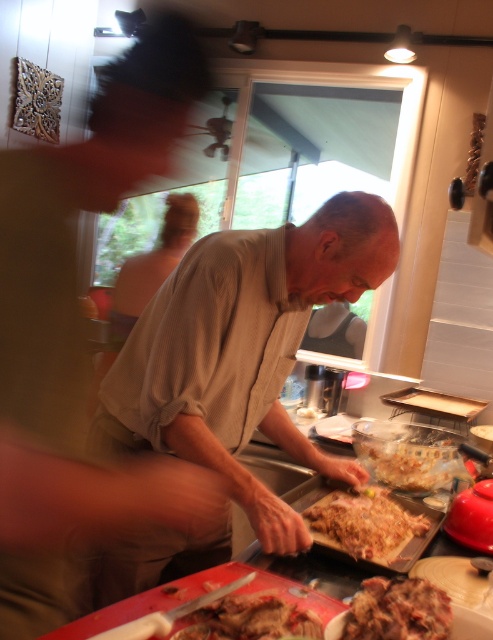
Question: Which point is closer to the camera?

Choices:
 (A) click(411, 484)
 (B) click(97, 602)
 (C) click(441, 616)

Answer: (C)

Question: Can you confirm if brown meat at center is thinner than brown crumbly bread at center?

Choices:
 (A) no
 (B) yes

Answer: (B)

Question: Can you confirm if light beige shirt at center is positioned above meaty brown meat at center?

Choices:
 (A) no
 (B) yes

Answer: (B)

Question: Which object is positioned closest to the light beige shirt at center?

Choices:
 (A) meaty brown meat at center
 (B) brown meat at center
 (C) brown crumbly bread at center

Answer: (C)

Question: Which object is farther from the camera taking this photo?

Choices:
 (A) light beige shirt at center
 (B) meaty brown meat at center
 (C) brown meat at center

Answer: (A)

Question: Does light beige shirt at center have a larger size compared to brown crispy skin at center?

Choices:
 (A) no
 (B) yes

Answer: (B)